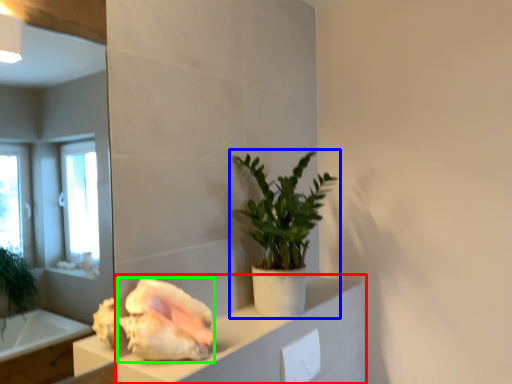
Question: Which object is positioned farthest from cabinetry (highlighted by a red box)? Select from houseplant (highlighted by a blue box) and flower (highlighted by a green box).

Choices:
 (A) houseplant
 (B) flower

Answer: (A)